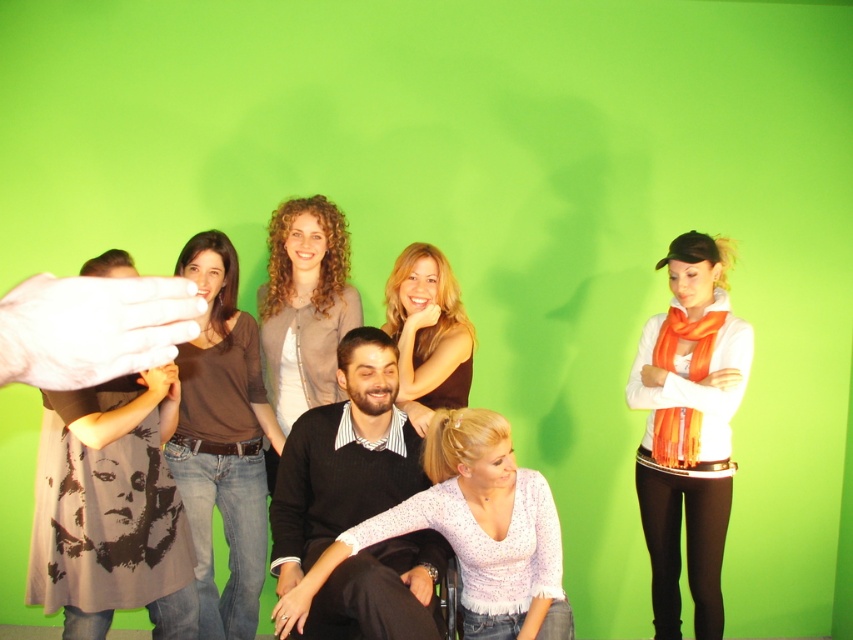
You are a photographer setting up for a group photo. You want to ensure the matte black sweater at center is positioned exactly at the center of the frame. Based on the scene description, is the sweater currently centered? Explain your reasoning using the coordinates provided.

The coordinates of the matte black sweater at center are given as point (111, 509). In a standard coordinate system where the origin is at the bottom left corner, the center would be at approximately (426, 320). Since both coordinates are higher than 0.5, the sweater is actually positioned to the right and above the true center of the frame. Therefore, it is not currently centered.

You are part of a photography team setting up a group shot. You notice the matte black sweater at center and the white textured blouse at center in the scene. Which clothing item is closer to the camera?

The matte black sweater at center is in front of the white textured blouse at center, so it is closer to the camera.

You are part of a photography team setting up for a group shot. You notice the black sweater at center and the curly hair woman at center in the scene. Which object is positioned lower in the image?

The black sweater at center is located below curly hair woman at center, so the black sweater at center is positioned lower in the image.